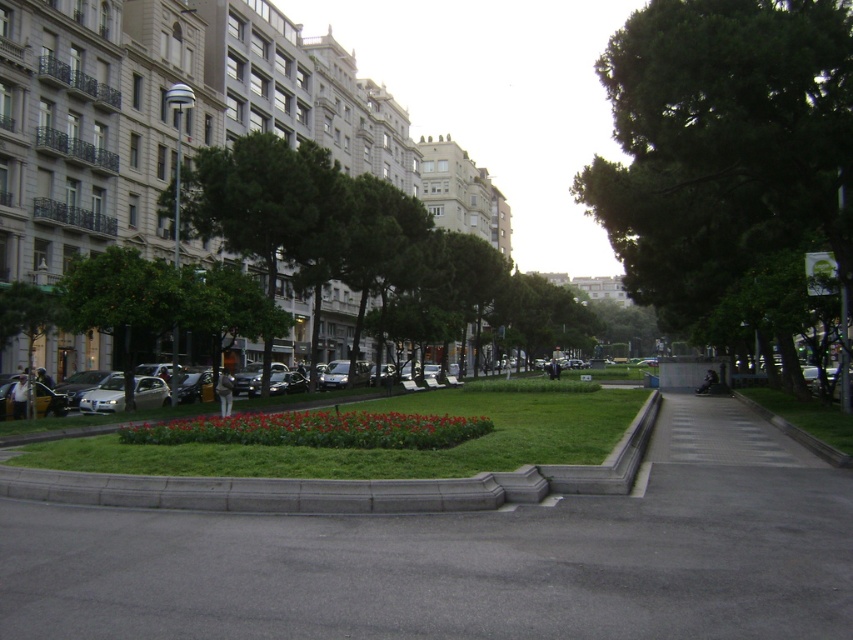
Looking at this image, you are a gardener who needs to place a new decorative rock garden between the gray concrete curb at lower center and the green grass at lower right. Based on their positions, where should the rock garden be placed?

The gray concrete curb at lower center is located above the green grass at lower right, so the rock garden should be placed between them, below the curb and above the grass.

You are a gardener planning to mow the green grass at center. The gray concrete curb at lower center is in the way. Can you mow the grass without moving the curb?

The green grass at center is below the gray concrete curb at lower center, so you can mow the grass without moving the curb since it is positioned lower and likely accessible from below.

You are a gardener who needs to place a small statue on the gray concrete curb at lower center and the green grass at lower right. Which surface will make the statue more visible from a distance?

The gray concrete curb at lower center has a lesser height compared to the green grass at lower right, so placing the statue on the green grass at lower right will make it more visible from a distance because it is higher.